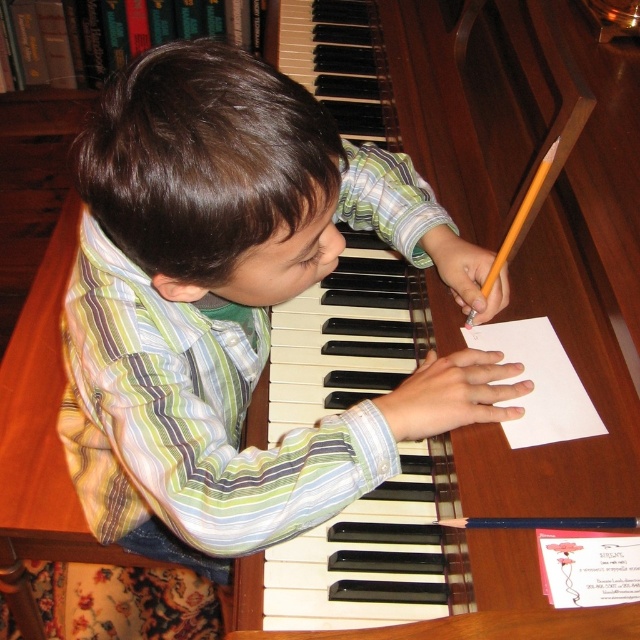
Who is more forward, (67,401) or (518,356)?

Point (518,356) is in front.

Does striped cotton shirt at center appear under white paper at lower right?

Yes, striped cotton shirt at center is below white paper at lower right.

Between point (228, 330) and point (584, 392), which one is positioned behind?

Positioned behind is point (584, 392).

Where is `striped cotton shirt at center`? The height and width of the screenshot is (640, 640). striped cotton shirt at center is located at coordinates (232, 307).

Which is below, striped cotton shirt at center or wooden piano keys at center?

striped cotton shirt at center is below.

Between striped cotton shirt at center and wooden piano keys at center, which one appears on the right side from the viewer's perspective?

wooden piano keys at center is more to the right.

What do you see at coordinates (232, 307) in the screenshot? The width and height of the screenshot is (640, 640). I see `striped cotton shirt at center` at bounding box center [232, 307].

You are a GUI agent. You are given a task and a screenshot of the screen. Output one action in this format:
    pyautogui.click(x=<x>, y=<y>)
    Task: Click on the striped cotton shirt at center
    This screenshot has width=640, height=640.
    Given the screenshot: What is the action you would take?
    pyautogui.click(x=232, y=307)

How far apart are wooden piano keys at center and white paper at lower right?

They are 9.75 inches apart.

From the picture: Can you confirm if wooden piano keys at center is taller than white paper at lower right?

Correct, wooden piano keys at center is much taller as white paper at lower right.

Is point (404, 86) farther from camera compared to point (525, 401)?

Yes, point (404, 86) is behind point (525, 401).

The image size is (640, 640). Identify the location of wooden piano keys at center. (476, 497).